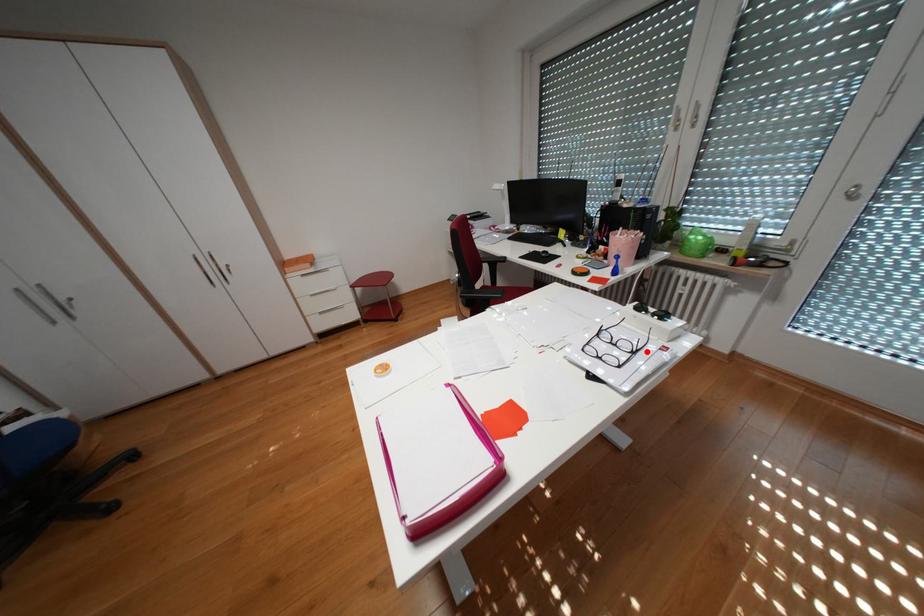
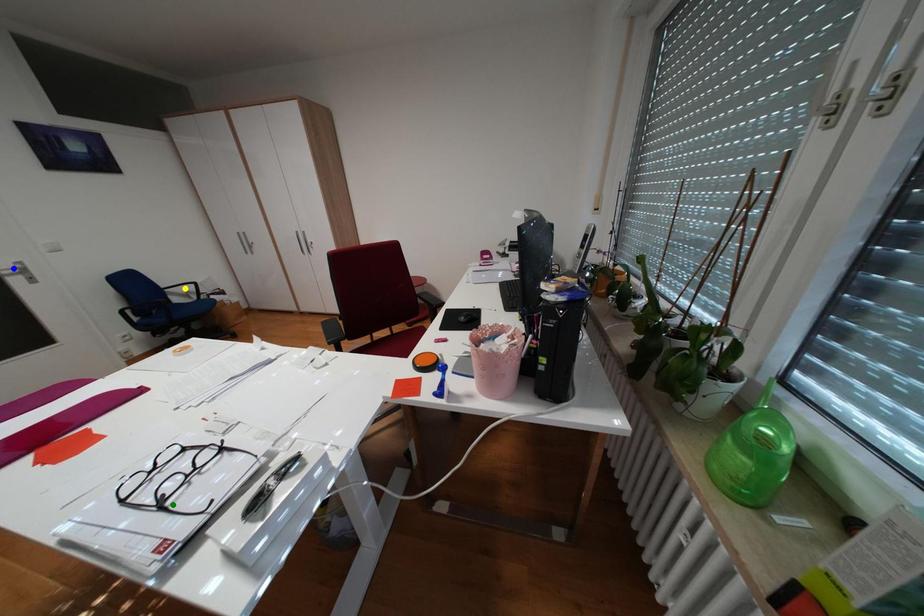
Question: I am providing you with two images of the same scene from different viewpoints. A red point is marked on the first image. You are given multiple points on the second image. In image 2, which mark is for the same physical point as the one in image 1?

Choices:
 (A) blue point
 (B) green point
 (C) yellow point

Answer: (B)